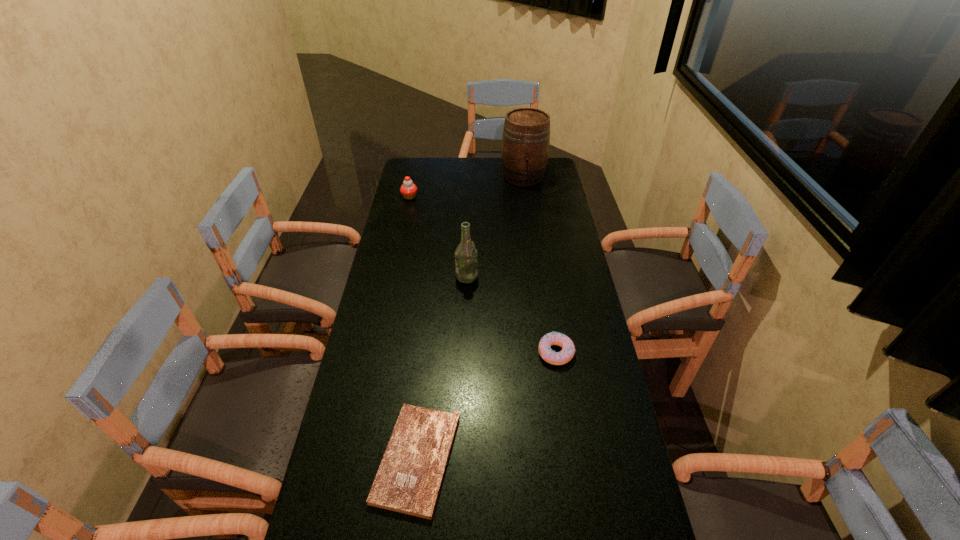
The width and height of the screenshot is (960, 540). Identify the location of object at the far right corner. 526,135.

At what (x,y) coordinates should I click in order to perform the action: click on free space at the far edge of the desktop. Please return your answer as a coordinate pair (x, y). Looking at the image, I should click on (495, 182).

Image resolution: width=960 pixels, height=540 pixels. Identify the location of vacant region at the left edge. (404, 330).

The image size is (960, 540). What are the coordinates of `vacant region at the right edge of the desktop` in the screenshot? It's located at (557, 413).

Locate an element on the screen. This screenshot has height=540, width=960. free space at the far left corner of the desktop is located at coordinates (437, 161).

Identify the location of blank region between the nearest object and the beer bottle. (442, 368).

Where is `vacant space that's between the third shortest object and the doughnut`? vacant space that's between the third shortest object and the doughnut is located at coordinates (483, 275).

Where is `vacant space in between the second tallest object and the cider`? The height and width of the screenshot is (540, 960). vacant space in between the second tallest object and the cider is located at coordinates (495, 226).

Locate an element on the screen. The image size is (960, 540). vacant space that is in between the shortest object and the fourth nearest object is located at coordinates (413, 328).

Locate an element on the screen. This screenshot has height=540, width=960. free spot between the nearest object and the third farthest object is located at coordinates (442, 368).